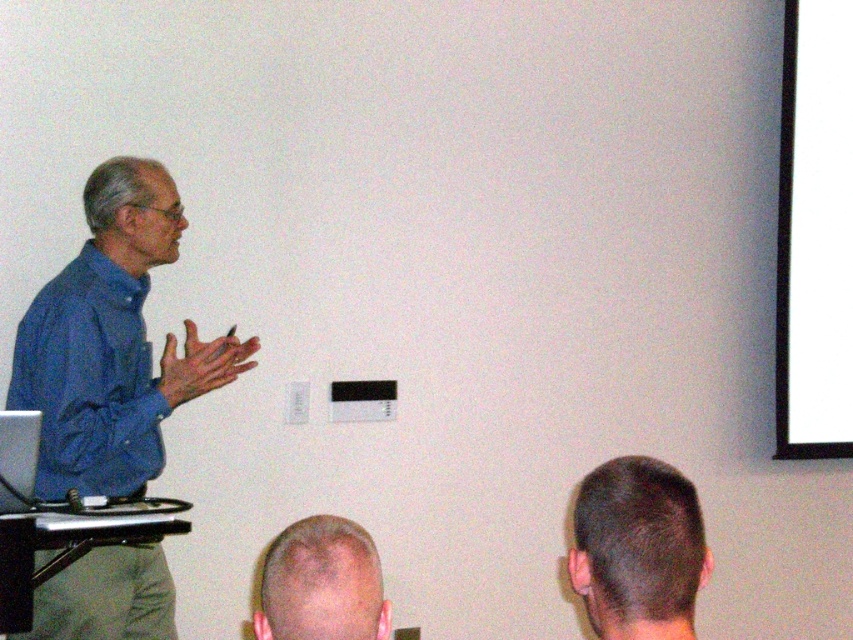
You are a student sitting in the front row of the classroom. You notice two points marked on the whiteboard. The first point is at coordinates point (837, 433) and the second is at point (566, 564). Which point is closer to you?

Point (566, 564) is closer to you because it is less further to the camera than point (837, 433).

You are a student sitting in the classroom and notice the blue cotton shirt at left and the light brown hair at lower center. Which object is positioned higher in the image?

The blue cotton shirt at left is located above the light brown hair at lower center, so it is positioned higher in the image.

You are a student sitting at the back of the classroom. You see the blue cotton shirt at left and the light brown hair at lower center. Which object is closer to your left side?

The blue cotton shirt at left is closer to your left side because it is positioned to the left of the light brown hair at lower center.